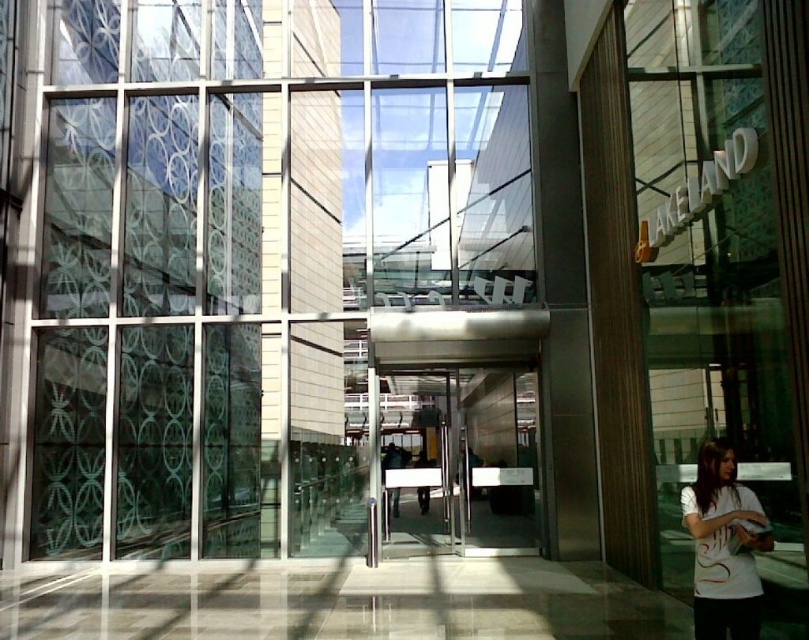
Question: Considering the relative positions of transparent glass door at center and white cotton t-shirt at lower right in the image provided, where is transparent glass door at center located with respect to white cotton t-shirt at lower right?

Choices:
 (A) right
 (B) left

Answer: (B)

Question: Which of the following is the farthest from the observer?

Choices:
 (A) (450, 432)
 (B) (752, 628)

Answer: (A)

Question: Which point is closer to the camera?

Choices:
 (A) white cotton t-shirt at lower right
 (B) transparent glass door at center

Answer: (A)

Question: Does transparent glass door at center have a lesser width compared to white cotton t-shirt at lower right?

Choices:
 (A) no
 (B) yes

Answer: (A)

Question: Does transparent glass door at center appear over white cotton t-shirt at lower right?

Choices:
 (A) yes
 (B) no

Answer: (B)